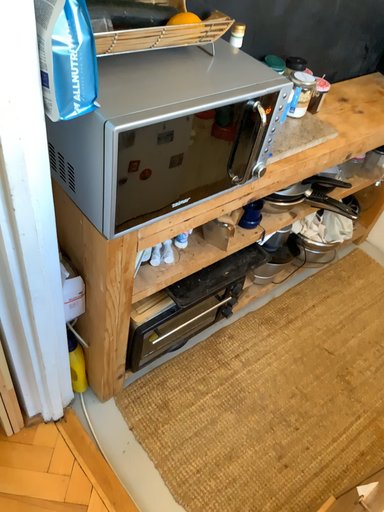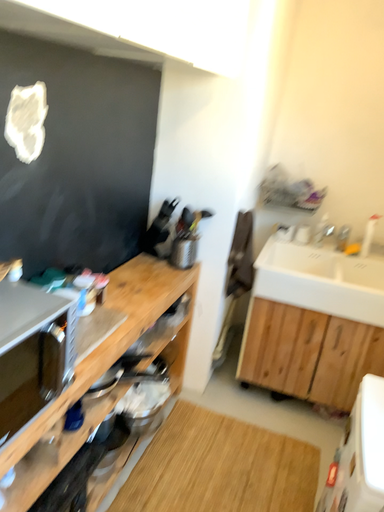
Question: How did the camera likely rotate when shooting the video?

Choices:
 (A) rotated upward
 (B) rotated downward

Answer: (A)